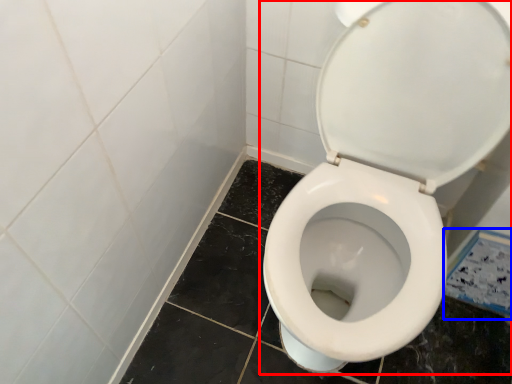
Question: Which of the following is the farthest to the observer, toilet (highlighted by a red box) or ceramic tile (highlighted by a blue box)?

Choices:
 (A) toilet
 (B) ceramic tile

Answer: (B)